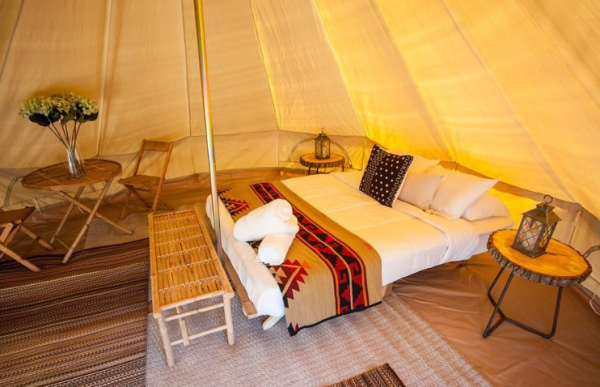
You are a GUI agent. You are given a task and a screenshot of the screen. Output one action in this format:
    pyautogui.click(x=<x>, y=<y>)
    Task: Click on the bed
    The image size is (600, 387).
    Given the screenshot: What is the action you would take?
    pyautogui.click(x=418, y=240)